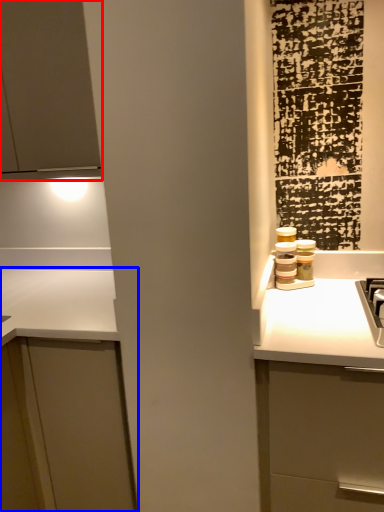
Question: Which object appears closest to the camera in this image, cabinetry (highlighted by a red box) or cabinetry (highlighted by a blue box)?

Choices:
 (A) cabinetry
 (B) cabinetry

Answer: (B)